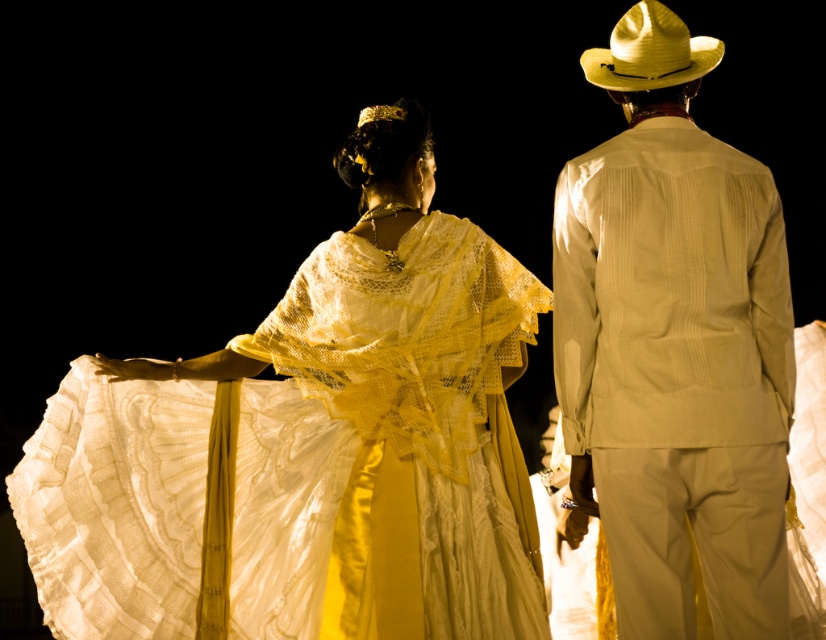
Question: Among these points, which one is nearest to the camera?

Choices:
 (A) (630, 12)
 (B) (471, 630)

Answer: (B)

Question: Is light beige textured suit at right wider than straw cowboy hat at upper right?

Choices:
 (A) yes
 (B) no

Answer: (A)

Question: Observing the image, what is the correct spatial positioning of matte white lace dress at center in reference to light beige textured suit at right?

Choices:
 (A) above
 (B) below

Answer: (B)

Question: Among these objects, which one is nearest to the camera?

Choices:
 (A) matte white lace dress at center
 (B) light beige textured suit at right
 (C) straw cowboy hat at upper right

Answer: (A)

Question: Does matte white lace dress at center appear over light beige textured suit at right?

Choices:
 (A) no
 (B) yes

Answer: (A)

Question: Which point is closer to the camera taking this photo?

Choices:
 (A) tap(637, 28)
 (B) tap(380, 536)

Answer: (B)